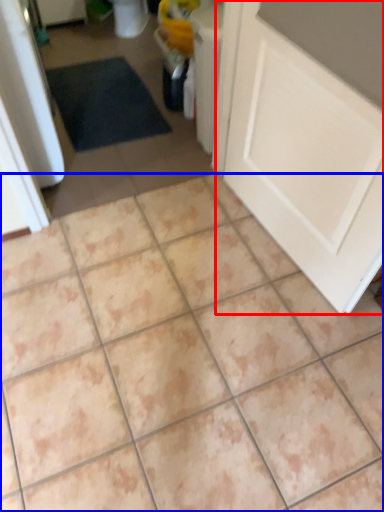
Question: Which object appears closest to the camera in this image, door (highlighted by a red box) or ceramic tile (highlighted by a blue box)?

Choices:
 (A) door
 (B) ceramic tile

Answer: (A)